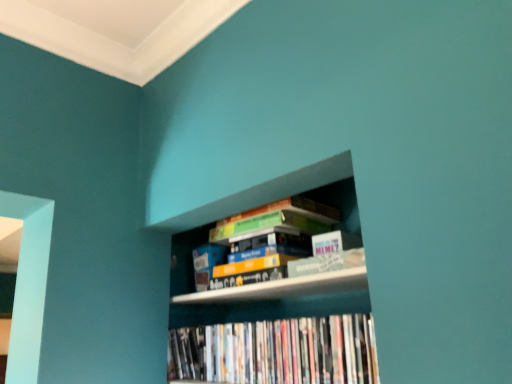
Locate an element on the screen. hardcover books at upper center, the second book in the bottom-to-top sequence is located at coordinates (275, 228).

At what (x,y) coordinates should I click in order to perform the action: click on white glossy dvds at lower center, which ranks as the 2th book in top-to-bottom order. Please return your answer as a coordinate pair (x, y). This screenshot has height=384, width=512. Looking at the image, I should click on [x=278, y=351].

Locate an element on the screen. This screenshot has width=512, height=384. book below the wooden bookshelf at center (from the image's perspective) is located at coordinates (278, 351).

Does white glossy dvds at lower center, which ranks as the first book in bottom-to-top order, turn towards wooden bookshelf at center?

Yes, white glossy dvds at lower center, which ranks as the first book in bottom-to-top order, is aimed at wooden bookshelf at center.

Is white glossy dvds at lower center, which ranks as the 2th book in top-to-bottom order, positioned before wooden bookshelf at center?

No, the depth of white glossy dvds at lower center, which ranks as the 2th book in top-to-bottom order, is greater than that of wooden bookshelf at center.

Does white glossy dvds at lower center, which ranks as the first book in bottom-to-top order, have a larger size compared to hardcover books at upper center, the second book in the bottom-to-top sequence?

Incorrect, white glossy dvds at lower center, which ranks as the first book in bottom-to-top order, is not larger than hardcover books at upper center, the second book in the bottom-to-top sequence.

From the image's perspective, is white glossy dvds at lower center, which ranks as the 2th book in top-to-bottom order, located above or below hardcover books at upper center, the first book in the top-to-bottom sequence?

Based on their image positions, white glossy dvds at lower center, which ranks as the 2th book in top-to-bottom order, is located beneath hardcover books at upper center, the first book in the top-to-bottom sequence.

Considering the positions of points (276, 360) and (244, 228), is point (276, 360) farther from camera compared to point (244, 228)?

No, it is not.

Is white glossy dvds at lower center, which ranks as the 2th book in top-to-bottom order, not within hardcover books at upper center, the second book in the bottom-to-top sequence?

white glossy dvds at lower center, which ranks as the 2th book in top-to-bottom order, is positioned outside hardcover books at upper center, the second book in the bottom-to-top sequence.

Between point (277, 204) and point (226, 327), which one is positioned behind?

The point (226, 327) is farther.

Consider the image. Considering their positions, is hardcover books at upper center, the second book in the bottom-to-top sequence, located in front of or behind wooden bookshelf at center?

Visually, hardcover books at upper center, the second book in the bottom-to-top sequence, is located behind wooden bookshelf at center.

Identify the location of book above the wooden bookshelf at center (from the image's perspective). This screenshot has width=512, height=384. (275, 228).

Based on the photo, is hardcover books at upper center, the first book in the top-to-bottom sequence, completely or partially outside of white glossy dvds at lower center, which ranks as the 2th book in top-to-bottom order?

Yes, hardcover books at upper center, the first book in the top-to-bottom sequence, is not within white glossy dvds at lower center, which ranks as the 2th book in top-to-bottom order.

Which of these two, hardcover books at upper center, the second book in the bottom-to-top sequence, or white glossy dvds at lower center, which ranks as the first book in bottom-to-top order, is wider?

hardcover books at upper center, the second book in the bottom-to-top sequence, is wider.

Is hardcover books at upper center, the first book in the top-to-bottom sequence, at the left side of white glossy dvds at lower center, which ranks as the first book in bottom-to-top order?

No, hardcover books at upper center, the first book in the top-to-bottom sequence, is not to the left of white glossy dvds at lower center, which ranks as the first book in bottom-to-top order.

From the image's perspective, is wooden bookshelf at center located above or below white glossy dvds at lower center, which ranks as the first book in bottom-to-top order?

Clearly, from the image's perspective, wooden bookshelf at center is above white glossy dvds at lower center, which ranks as the first book in bottom-to-top order.

Is wooden bookshelf at center inside or outside of white glossy dvds at lower center, which ranks as the first book in bottom-to-top order?

wooden bookshelf at center exists outside the volume of white glossy dvds at lower center, which ranks as the first book in bottom-to-top order.

Could you tell me if wooden bookshelf at center is turned towards white glossy dvds at lower center, which ranks as the first book in bottom-to-top order?

Yes, wooden bookshelf at center is aimed at white glossy dvds at lower center, which ranks as the first book in bottom-to-top order.

Which object is closer to the camera taking this photo, wooden bookshelf at center or white glossy dvds at lower center, which ranks as the 2th book in top-to-bottom order?

wooden bookshelf at center is more forward.

From a real-world perspective, is wooden bookshelf at center physically located above or below hardcover books at upper center, the first book in the top-to-bottom sequence?

Clearly, from a real-world perspective, wooden bookshelf at center is below hardcover books at upper center, the first book in the top-to-bottom sequence.

Which of these two, wooden bookshelf at center or hardcover books at upper center, the first book in the top-to-bottom sequence, is thinner?

hardcover books at upper center, the first book in the top-to-bottom sequence.

Does wooden bookshelf at center come in front of hardcover books at upper center, the first book in the top-to-bottom sequence?

Yes, it is.

From the image's perspective, is wooden bookshelf at center located above or below hardcover books at upper center, the second book in the bottom-to-top sequence?

Clearly, from the image's perspective, wooden bookshelf at center is below hardcover books at upper center, the second book in the bottom-to-top sequence.

In order to click on bookcase in front of the white glossy dvds at lower center, which ranks as the first book in bottom-to-top order in this screenshot , I will do `click(276, 299)`.

In the image, there is a hardcover books at upper center, the second book in the bottom-to-top sequence. At what (x,y) coordinates should I click in order to perform the action: click on book below it (from the image's perspective). Please return your answer as a coordinate pair (x, y). This screenshot has height=384, width=512. Looking at the image, I should click on (278, 351).

When comparing their distances from white glossy dvds at lower center, which ranks as the 2th book in top-to-bottom order, does hardcover books at upper center, the first book in the top-to-bottom sequence, or wooden bookshelf at center seem further?

hardcover books at upper center, the first book in the top-to-bottom sequence, is further to white glossy dvds at lower center, which ranks as the 2th book in top-to-bottom order.

Which object lies nearer to the anchor point wooden bookshelf at center, hardcover books at upper center, the first book in the top-to-bottom sequence, or white glossy dvds at lower center, which ranks as the first book in bottom-to-top order?

white glossy dvds at lower center, which ranks as the first book in bottom-to-top order.

In the scene shown: Looking at the image, which one is located further to white glossy dvds at lower center, which ranks as the 2th book in top-to-bottom order, wooden bookshelf at center or hardcover books at upper center, the second book in the bottom-to-top sequence?

Based on the image, hardcover books at upper center, the second book in the bottom-to-top sequence, appears to be further to white glossy dvds at lower center, which ranks as the 2th book in top-to-bottom order.

Based on the photo, based on their spatial positions, is wooden bookshelf at center or white glossy dvds at lower center, which ranks as the 2th book in top-to-bottom order, further from hardcover books at upper center, the second book in the bottom-to-top sequence?

white glossy dvds at lower center, which ranks as the 2th book in top-to-bottom order, is further to hardcover books at upper center, the second book in the bottom-to-top sequence.

Considering their positions, is white glossy dvds at lower center, which ranks as the first book in bottom-to-top order, positioned further to hardcover books at upper center, the first book in the top-to-bottom sequence, than wooden bookshelf at center?

Among the two, white glossy dvds at lower center, which ranks as the first book in bottom-to-top order, is located further to hardcover books at upper center, the first book in the top-to-bottom sequence.

Which object lies nearer to the anchor point wooden bookshelf at center, white glossy dvds at lower center, which ranks as the first book in bottom-to-top order, or hardcover books at upper center, the second book in the bottom-to-top sequence?

Based on the image, white glossy dvds at lower center, which ranks as the first book in bottom-to-top order, appears to be nearer to wooden bookshelf at center.

Find the location of a particular element. The image size is (512, 384). book between wooden bookshelf at center and hardcover books at upper center, the first book in the top-to-bottom sequence, in the front-back direction is located at coordinates (278, 351).